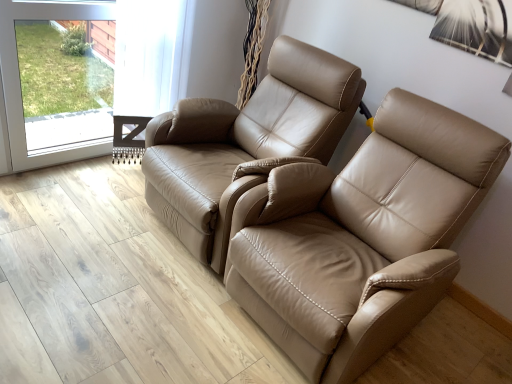
Question: Can we say transparent glass screen door at upper left lies outside tan leather recliner at center, the second chair in the left-to-right sequence?

Choices:
 (A) no
 (B) yes

Answer: (B)

Question: From a real-world perspective, is transparent glass screen door at upper left on top of tan leather recliner at center, the second chair in the left-to-right sequence?

Choices:
 (A) yes
 (B) no

Answer: (B)

Question: Does transparent glass screen door at upper left appear on the left side of tan leather recliner at center, which appears as the first chair when viewed from the right?

Choices:
 (A) no
 (B) yes

Answer: (B)

Question: From the image's perspective, does transparent glass screen door at upper left appear higher than tan leather recliner at center, the second chair in the left-to-right sequence?

Choices:
 (A) no
 (B) yes

Answer: (B)

Question: From the image's perspective, is transparent glass screen door at upper left beneath tan leather recliner at center, which appears as the first chair when viewed from the right?

Choices:
 (A) no
 (B) yes

Answer: (A)

Question: Is transparent glass screen door at upper left wider or thinner than tan leather chair at center, the first chair from the left?

Choices:
 (A) wide
 (B) thin

Answer: (B)

Question: Does point (34, 16) appear closer or farther from the camera than point (233, 117)?

Choices:
 (A) closer
 (B) farther

Answer: (A)

Question: Is transparent glass screen door at upper left spatially inside tan leather chair at center, arranged as the second chair when viewed from the right, or outside of it?

Choices:
 (A) inside
 (B) outside

Answer: (B)

Question: From a real-world perspective, is transparent glass screen door at upper left above or below tan leather chair at center, the first chair from the left?

Choices:
 (A) below
 (B) above

Answer: (A)

Question: Is point pyautogui.click(x=177, y=196) positioned closer to the camera than point pyautogui.click(x=20, y=129)?

Choices:
 (A) closer
 (B) farther

Answer: (A)

Question: Considering the positions of tan leather chair at center, arranged as the second chair when viewed from the right, and transparent glass screen door at upper left in the image, is tan leather chair at center, arranged as the second chair when viewed from the right, wider or thinner than transparent glass screen door at upper left?

Choices:
 (A) wide
 (B) thin

Answer: (A)

Question: Visually, is tan leather chair at center, the first chair from the left, positioned to the left or to the right of transparent glass screen door at upper left?

Choices:
 (A) left
 (B) right

Answer: (B)

Question: From the image's perspective, is tan leather chair at center, the first chair from the left, above or below transparent glass screen door at upper left?

Choices:
 (A) below
 (B) above

Answer: (A)

Question: Considering the relative positions of tan leather chair at center, arranged as the second chair when viewed from the right, and tan leather recliner at center, which appears as the first chair when viewed from the right, in the image provided, is tan leather chair at center, arranged as the second chair when viewed from the right, to the left or to the right of tan leather recliner at center, which appears as the first chair when viewed from the right,?

Choices:
 (A) right
 (B) left

Answer: (B)

Question: Looking at the image, does tan leather chair at center, the first chair from the left, seem bigger or smaller compared to tan leather recliner at center, which appears as the first chair when viewed from the right?

Choices:
 (A) small
 (B) big

Answer: (A)